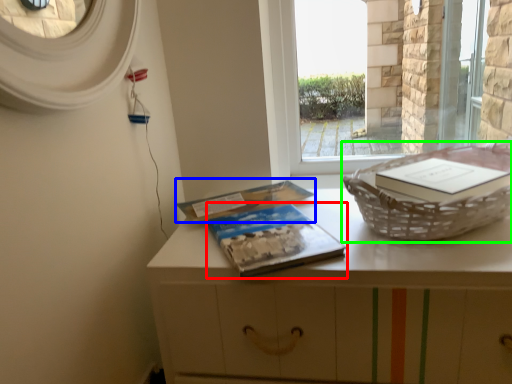
Question: Based on their relative distances, which object is farther from paperback book (highlighted by a red box)? Choose from paperback book (highlighted by a blue box) and basket container (highlighted by a green box).

Choices:
 (A) paperback book
 (B) basket container

Answer: (B)